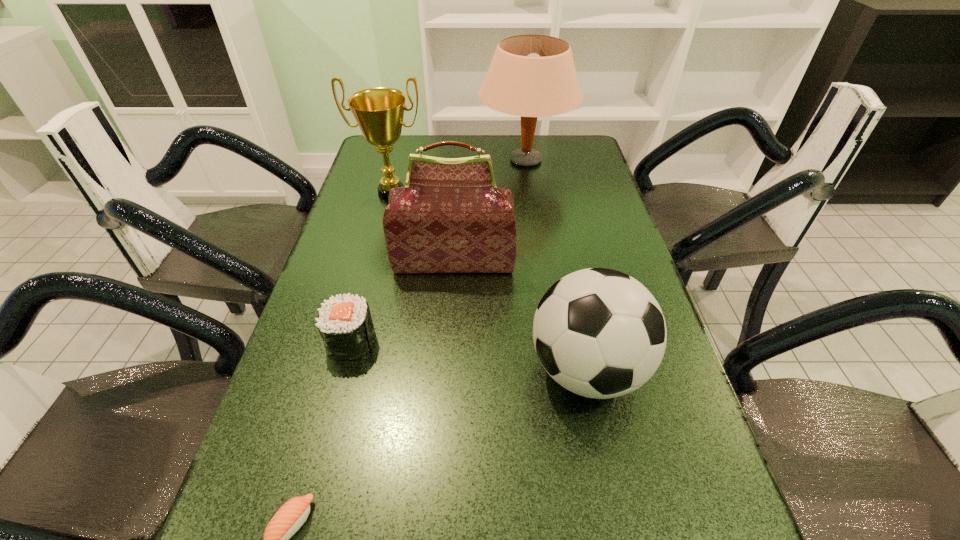
Identify the location of vacant region located on the front-facing side of the handbag. This screenshot has width=960, height=540. (446, 377).

This screenshot has height=540, width=960. In order to click on vacant area situated on the left of the third shortest object in this screenshot , I will do (417, 369).

This screenshot has width=960, height=540. I want to click on free space located on the right of the farther sushi, so click(498, 341).

Where is `object located in the far edge section of the desktop`? object located in the far edge section of the desktop is located at coordinates (531, 76).

Image resolution: width=960 pixels, height=540 pixels. I want to click on award present at the left edge, so click(x=379, y=112).

The image size is (960, 540). Identify the location of sushi that is at the left edge. (344, 322).

Image resolution: width=960 pixels, height=540 pixels. Find the location of `lampshade that is at the right edge`. lampshade that is at the right edge is located at coordinates (531, 76).

Identify the location of soccer ball present at the right edge. The image size is (960, 540). (599, 333).

Where is `object that is at the far right corner`? Image resolution: width=960 pixels, height=540 pixels. object that is at the far right corner is located at coordinates (531, 76).

Locate an element on the screen. free space at the far edge of the desktop is located at coordinates (505, 137).